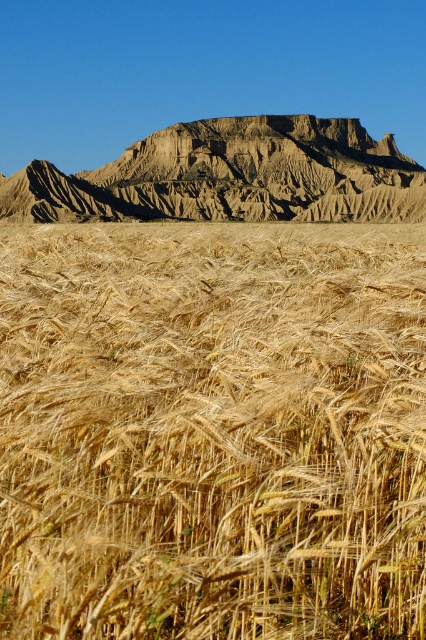
Does golden wheat field at center have a lesser height compared to rugged brown rock formation at upper center?

Yes, golden wheat field at center is shorter than rugged brown rock formation at upper center.

Who is higher up, golden wheat field at center or rugged brown rock formation at upper center?

rugged brown rock formation at upper center is above.

Image resolution: width=426 pixels, height=640 pixels. Identify the location of golden wheat field at center. 212,429.

Identify the location of golden wheat field at center. The height and width of the screenshot is (640, 426). pyautogui.click(x=212, y=429).